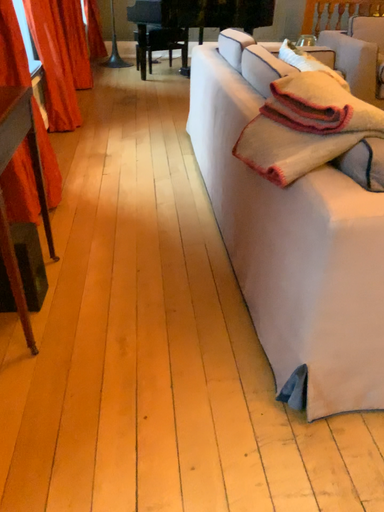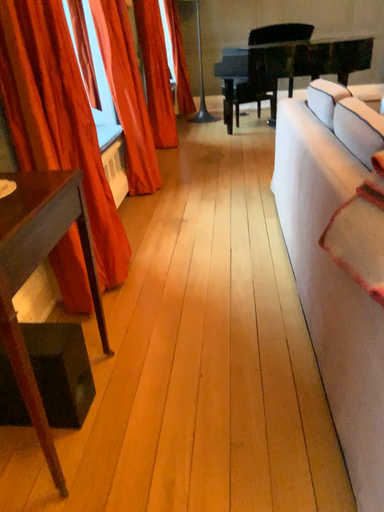
Question: How did the camera likely rotate when shooting the video?

Choices:
 (A) rotated left
 (B) rotated right

Answer: (A)